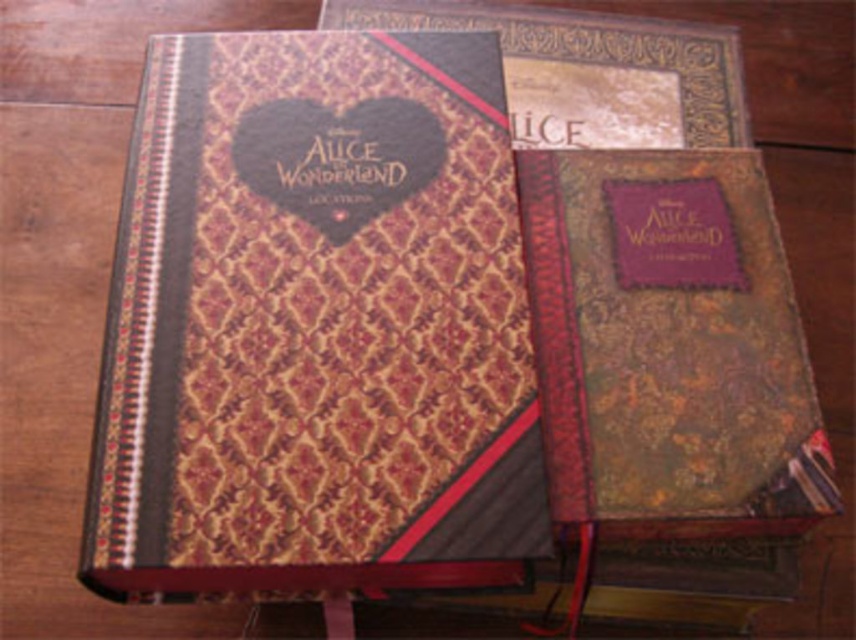
Measure the distance between gold-patterned leather journal at center and camera.

They are 29.39 inches apart.

Is point (340, 586) farther from viewer compared to point (645, 76)?

No, (340, 586) is closer to viewer.

Is point (287, 104) positioned before point (716, 76)?

Yes, point (287, 104) is closer to viewer.

Locate an element on the screen. This screenshot has height=640, width=856. gold-patterned leather journal at center is located at coordinates (316, 324).

Does gold textured journal at center appear over gold textured book at upper center?

No.

Between point (830, 484) and point (688, 131), which one is positioned in front?

Positioned in front is point (830, 484).

Is point (554, 273) more distant than point (575, 124)?

No.

Locate an element on the screen. The height and width of the screenshot is (640, 856). gold textured journal at center is located at coordinates (669, 339).

Is gold-patterned leather journal at center taller than gold textured journal at center?

Correct, gold-patterned leather journal at center is much taller as gold textured journal at center.

Between gold-patterned leather journal at center and gold textured journal at center, which one appears on the left side from the viewer's perspective?

Positioned to the left is gold-patterned leather journal at center.

Who is more distant from viewer, (236, 92) or (637, 177)?

Point (637, 177)

Locate an element on the screen. This screenshot has width=856, height=640. gold-patterned leather journal at center is located at coordinates (316, 324).